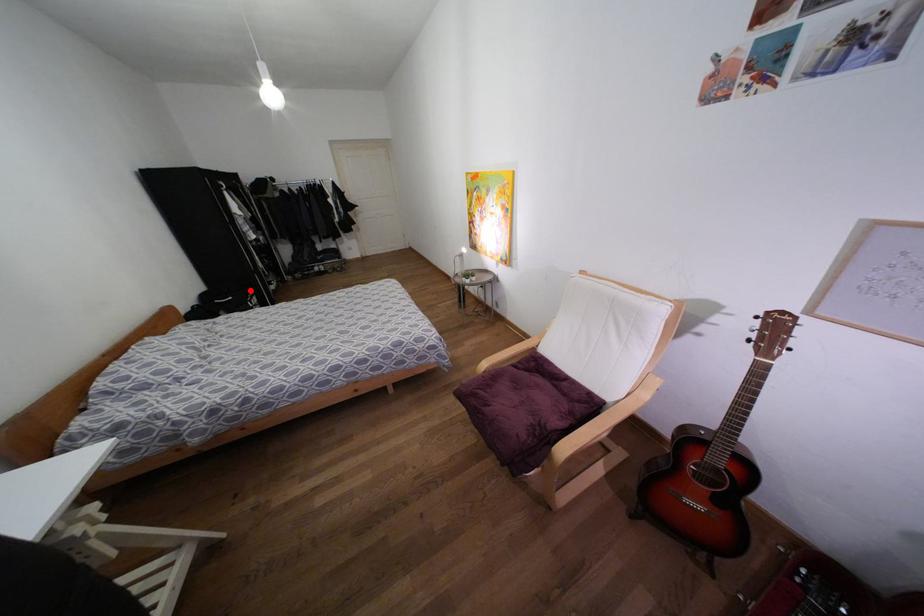
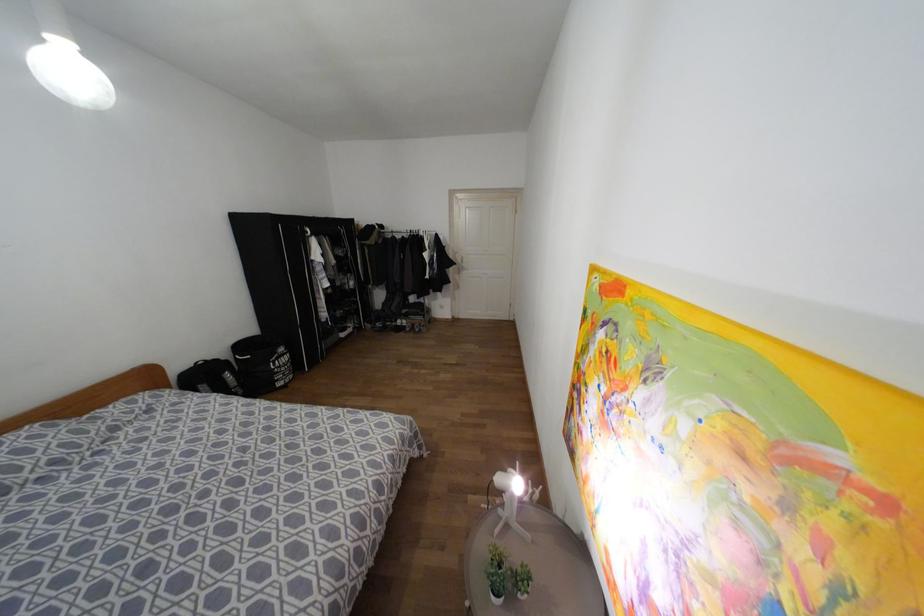
Question: I am providing you with two images of the same scene from different viewpoints. A red point is shown in image1. For the corresponding object point in image2, is it positioned nearer or farther from the camera?

Choices:
 (A) Nearer
 (B) Farther

Answer: (B)